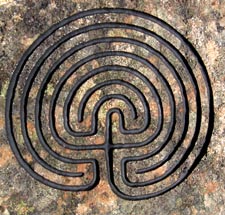
I want to click on counter top, so point(113,206).